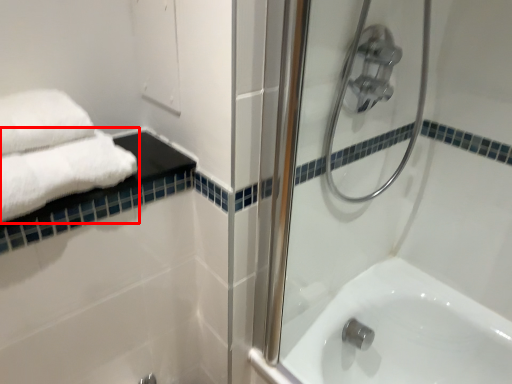
Question: From the image's perspective, where is towel (annotated by the red box) located in relation to shower door in the image?

Choices:
 (A) above
 (B) below

Answer: (A)